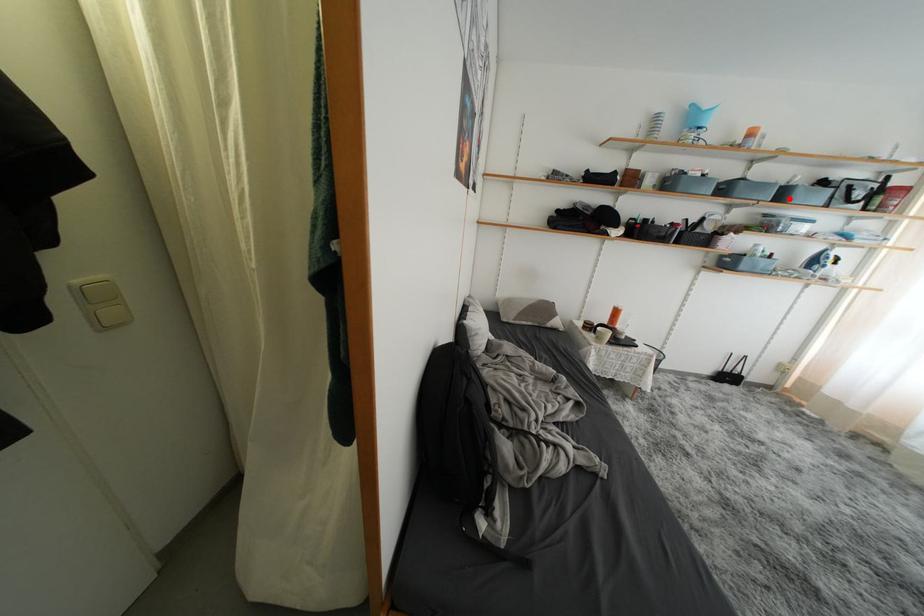
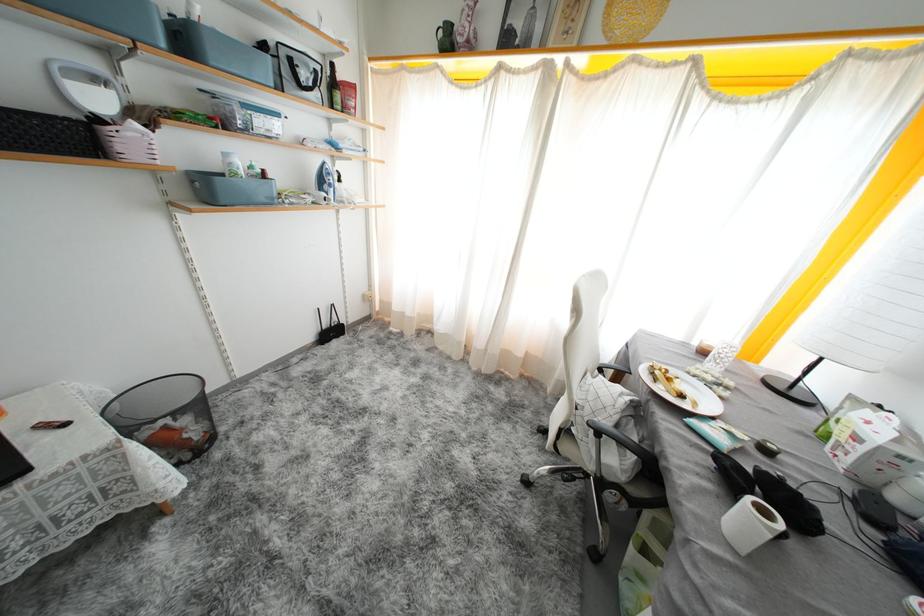
Find the pixel in the second image that matches the highlighted location in the first image.

(190, 44)